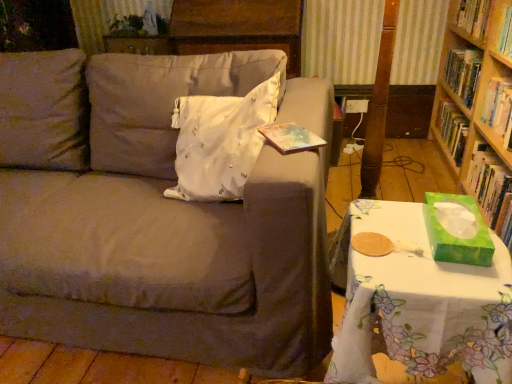
In order to click on hardcover book at upper right, the 2th book when ordered from top to bottom in this screenshot , I will do `click(499, 109)`.

The height and width of the screenshot is (384, 512). What do you see at coordinates (478, 105) in the screenshot? I see `green cardboard bookcase at right` at bounding box center [478, 105].

Measure the distance between point (489, 158) and camera.

They are 1.88 meters apart.

Image resolution: width=512 pixels, height=384 pixels. What do you see at coordinates (486, 22) in the screenshot? I see `hardcover book at upper right, which is the 3th book in bottom-to-top order` at bounding box center [486, 22].

The width and height of the screenshot is (512, 384). I want to click on green matte tissue box at right, which is the third book in top-to-bottom order, so click(x=490, y=189).

Locate an element on the screen. The width and height of the screenshot is (512, 384). hardcover book at upper right, the 2th book when ordered from top to bottom is located at coordinates (499, 109).

Can you confirm if hardcover book at upper right, the 2th book when ordered from top to bottom, is wider than green matte tissue box at right, placed as the first book when sorted from bottom to top?

Incorrect, the width of hardcover book at upper right, the 2th book when ordered from top to bottom, does not surpass that of green matte tissue box at right, placed as the first book when sorted from bottom to top.

From a real-world perspective, is hardcover book at upper right, the 2th book positioned from the bottom, located higher than green matte tissue box at right, placed as the first book when sorted from bottom to top?

Correct, in the physical world, hardcover book at upper right, the 2th book positioned from the bottom, is higher than green matte tissue box at right, placed as the first book when sorted from bottom to top.

Is hardcover book at upper right, the 2th book when ordered from top to bottom, touching green matte tissue box at right, which is the third book in top-to-bottom order?

hardcover book at upper right, the 2th book when ordered from top to bottom, is not next to green matte tissue box at right, which is the third book in top-to-bottom order, and they're not touching.

From the picture: Would you say hardcover book at upper right, which is counted as the 1th book, starting from the top, is outside white satin pillow at center?

Absolutely, hardcover book at upper right, which is counted as the 1th book, starting from the top, is external to white satin pillow at center.

From the image's perspective, which one is positioned lower, hardcover book at upper right, which is the 3th book in bottom-to-top order, or white satin pillow at center?

white satin pillow at center.

Between hardcover book at upper right, which is the 3th book in bottom-to-top order, and white satin pillow at center, which one has smaller width?

hardcover book at upper right, which is the 3th book in bottom-to-top order.

From a real-world perspective, is matte gray couch at center positioned over white satin pillow at center based on gravity?

No, from a real-world perspective, matte gray couch at center is not over white satin pillow at center

Looking at their sizes, would you say matte gray couch at center is wider or thinner than white satin pillow at center?

matte gray couch at center is wider than white satin pillow at center.

Is matte gray couch at center to the right of white satin pillow at center from the viewer's perspective?

In fact, matte gray couch at center is to the left of white satin pillow at center.

From the image's perspective, is matte gray couch at center located above white satin pillow at center?

Actually, matte gray couch at center appears below white satin pillow at center in the image.

Based on the photo, is green cardboard bookcase at right located outside hardcover book at upper right, which is counted as the 1th book, starting from the top?

Yes.

From the image's perspective, relative to hardcover book at upper right, which is counted as the 1th book, starting from the top, is green cardboard bookcase at right above or below?

green cardboard bookcase at right is below hardcover book at upper right, which is counted as the 1th book, starting from the top.

Would you say green cardboard bookcase at right is to the left or to the right of hardcover book at upper right, which is the 3th book in bottom-to-top order, in the picture?

green cardboard bookcase at right is to the left of hardcover book at upper right, which is the 3th book in bottom-to-top order.

Is green cardboard bookcase at right not close to hardcover book at upper right, which is the 3th book in bottom-to-top order?

No, there isn't a large distance between green cardboard bookcase at right and hardcover book at upper right, which is the 3th book in bottom-to-top order.

How many degrees apart are the facing directions of matte gray couch at center and green cardboard bookcase at right?

90.6 degrees.

Can you confirm if matte gray couch at center is thinner than green cardboard bookcase at right?

No, matte gray couch at center is not thinner than green cardboard bookcase at right.

Is matte gray couch at center not close to green cardboard bookcase at right?

Absolutely, matte gray couch at center is distant from green cardboard bookcase at right.

Considering the relative sizes of matte gray couch at center and green cardboard bookcase at right in the image provided, is matte gray couch at center smaller than green cardboard bookcase at right?

No.

The image size is (512, 384). Identify the location of table located in front of the hardcover book at upper right, which is the 3th book in bottom-to-top order. (420, 301).

Is white floral tablecloth at lower right at the left side of hardcover book at upper right, which is counted as the 1th book, starting from the top?

Indeed, white floral tablecloth at lower right is positioned on the left side of hardcover book at upper right, which is counted as the 1th book, starting from the top.

From a real-world perspective, which is physically above, white floral tablecloth at lower right or hardcover book at upper right, which is counted as the 1th book, starting from the top?

hardcover book at upper right, which is counted as the 1th book, starting from the top.

Find the location of a particular element. This screenshot has width=512, height=384. book that is the 2nd one when counting leftward from the hardcover book at upper right, which is counted as the 1th book, starting from the top is located at coordinates (499, 109).

Considering the points (505, 112) and (505, 13), which point is in front, point (505, 112) or point (505, 13)?

The point (505, 13) is in front.

In terms of size, does hardcover book at upper right, the 2th book when ordered from top to bottom, appear bigger or smaller than hardcover book at upper right, which is counted as the 1th book, starting from the top?

Clearly, hardcover book at upper right, the 2th book when ordered from top to bottom, is smaller in size than hardcover book at upper right, which is counted as the 1th book, starting from the top.

At what (x,y) coordinates should I click in order to perform the action: click on the 1st book to the right of the hardcover book at upper right, the 2th book when ordered from top to bottom, starting your count from the anchor. Please return your answer as a coordinate pair (x, y). This screenshot has height=384, width=512. Looking at the image, I should click on (490, 189).

Where is `book above the white satin pillow at center (from a real-world perspective)`? Image resolution: width=512 pixels, height=384 pixels. book above the white satin pillow at center (from a real-world perspective) is located at coordinates (486, 22).

When comparing their distances from white floral tablecloth at lower right, does white satin pillow at center or matte gray couch at center seem further?

Among the two, white satin pillow at center is located further to white floral tablecloth at lower right.

When comparing their distances from green matte tissue box at right, which is the third book in top-to-bottom order, does white floral tablecloth at lower right or matte gray couch at center seem closer?

The object closer to green matte tissue box at right, which is the third book in top-to-bottom order, is white floral tablecloth at lower right.

Estimate the real-world distances between objects in this image. Which object is further from matte gray couch at center, green cardboard bookcase at right or green matte tissue box at right, placed as the first book when sorted from bottom to top?

Based on the image, green cardboard bookcase at right appears to be further to matte gray couch at center.

Which object lies nearer to the anchor point hardcover book at upper right, the 2th book positioned from the bottom, white satin pillow at center or matte gray couch at center?

white satin pillow at center is positioned closer to the anchor hardcover book at upper right, the 2th book positioned from the bottom.

Estimate the real-world distances between objects in this image. Which object is closer to white floral tablecloth at lower right, green matte tissue box at right, which is the third book in top-to-bottom order, or hardcover book at upper right, which is the 3th book in bottom-to-top order?

Based on the image, green matte tissue box at right, which is the third book in top-to-bottom order, appears to be nearer to white floral tablecloth at lower right.

Looking at this image, considering their positions, is hardcover book at upper right, the 2th book positioned from the bottom, positioned closer to green cardboard bookcase at right than matte gray couch at center?

hardcover book at upper right, the 2th book positioned from the bottom, is positioned closer to the anchor green cardboard bookcase at right.

From the image, which object appears to be farther from green cardboard bookcase at right, green matte tissue box at right, which is the third book in top-to-bottom order, or white satin pillow at center?

Based on the image, white satin pillow at center appears to be further to green cardboard bookcase at right.

Estimate the real-world distances between objects in this image. Which object is closer to white satin pillow at center, green cardboard bookcase at right or white floral tablecloth at lower right?

white floral tablecloth at lower right is positioned closer to the anchor white satin pillow at center.

Image resolution: width=512 pixels, height=384 pixels. In order to click on table located between white satin pillow at center and hardcover book at upper right, which is counted as the 1th book, starting from the top, in the left-right direction in this screenshot , I will do `click(420, 301)`.

Identify the location of table between matte gray couch at center and green matte tissue box at right, which is the third book in top-to-bottom order. (420, 301).

You are a GUI agent. You are given a task and a screenshot of the screen. Output one action in this format:
    pyautogui.click(x=<x>, y=<y>)
    Task: Click on the book that lies between hardcover book at upper right, which is the 3th book in bottom-to-top order, and green matte tissue box at right, which is the third book in top-to-bottom order, from top to bottom
    
    Given the screenshot: What is the action you would take?
    pyautogui.click(x=499, y=109)

The image size is (512, 384). What are the coordinates of `bookcase between hardcover book at upper right, which is the 3th book in bottom-to-top order, and white floral tablecloth at lower right vertically` in the screenshot? It's located at (478, 105).